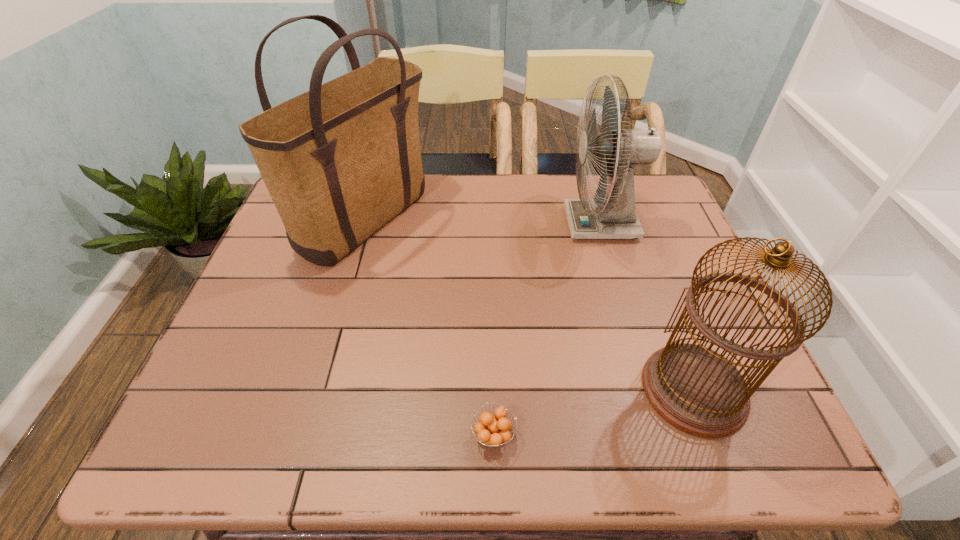
Identify the location of tote bag. (341, 160).

Locate an element on the screen. Image resolution: width=960 pixels, height=540 pixels. the tallest object is located at coordinates (341, 160).

Locate an element on the screen. The height and width of the screenshot is (540, 960). fan is located at coordinates (615, 217).

Identify the location of birdcage. The height and width of the screenshot is (540, 960). (697, 390).

The width and height of the screenshot is (960, 540). I want to click on orange fruit, so click(x=492, y=431).

Identify the location of the third object from right to left. The image size is (960, 540). (492, 431).

Where is `free space located 0.350m on the front of the tallest object`? free space located 0.350m on the front of the tallest object is located at coordinates (317, 399).

Where is `vacant space located on the front-facing side of the fan`? vacant space located on the front-facing side of the fan is located at coordinates (431, 224).

At what (x,y) coordinates should I click in order to perform the action: click on vacant region located 0.310m on the front-facing side of the fan. Please return your answer as a coordinate pair (x, y). Looking at the image, I should click on (459, 224).

The width and height of the screenshot is (960, 540). What are the coordinates of `free spot located on the front-facing side of the fan` in the screenshot? It's located at (487, 224).